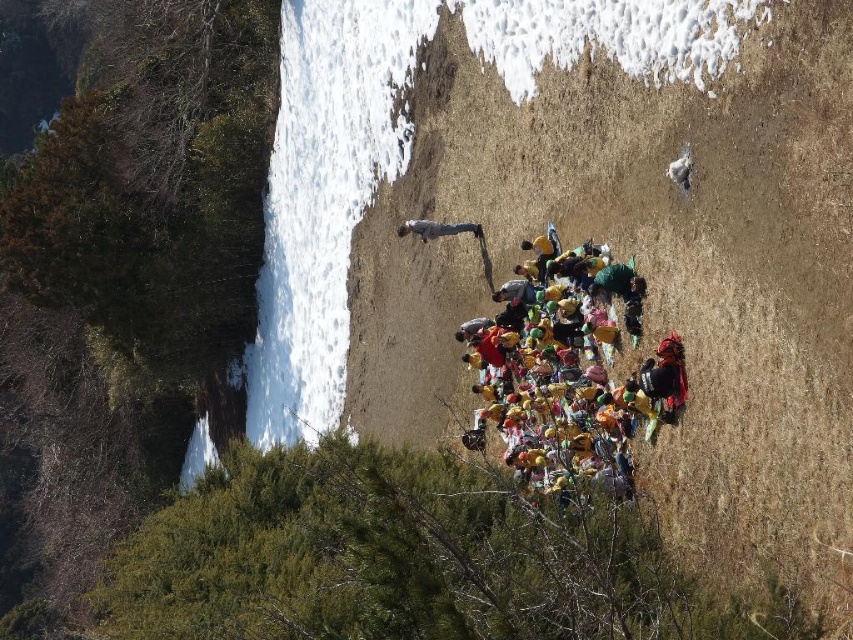
Question: From the image, what is the correct spatial relationship of multicolored fabric at center in relation to light gray jeans at upper center?

Choices:
 (A) left
 (B) right

Answer: (B)

Question: Among these points, which one is nearest to the camera?

Choices:
 (A) (405, 228)
 (B) (505, 413)

Answer: (B)

Question: Is the position of multicolored fabric at center less distant than that of light gray jeans at upper center?

Choices:
 (A) no
 (B) yes

Answer: (B)

Question: Which object is closer to the camera taking this photo?

Choices:
 (A) multicolored fabric at center
 (B) light gray jeans at upper center

Answer: (A)

Question: From the image, what is the correct spatial relationship of multicolored fabric at center in relation to light gray jeans at upper center?

Choices:
 (A) above
 (B) below

Answer: (B)